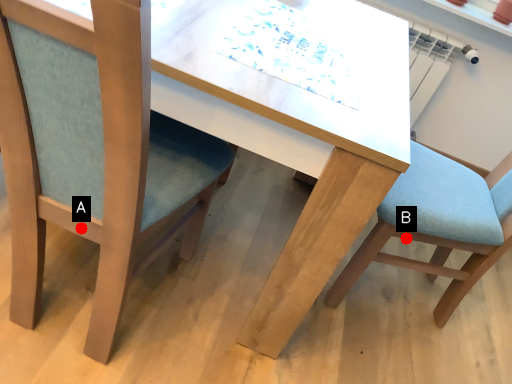
Question: Two points are circled on the image, labeled by A and B beside each circle. Which point is farther to the camera?

Choices:
 (A) A is further
 (B) B is further

Answer: (B)